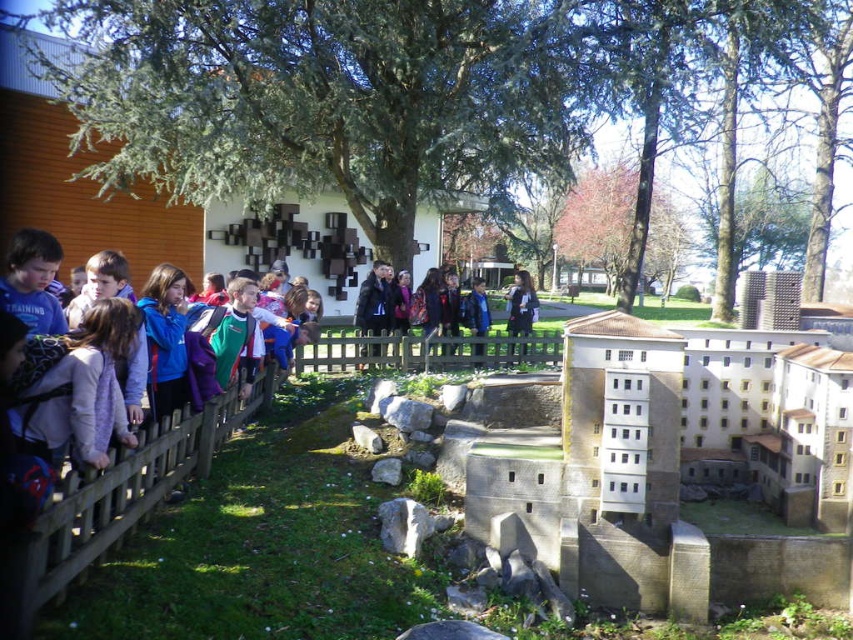
Describe the element at coordinates (128, 490) in the screenshot. I see `brown wooden fence at left` at that location.

Which is more to the right, brown wooden fence at left or brown wooden fence at center?

brown wooden fence at center is more to the right.

Image resolution: width=853 pixels, height=640 pixels. In order to click on brown wooden fence at left in this screenshot , I will do `click(128, 490)`.